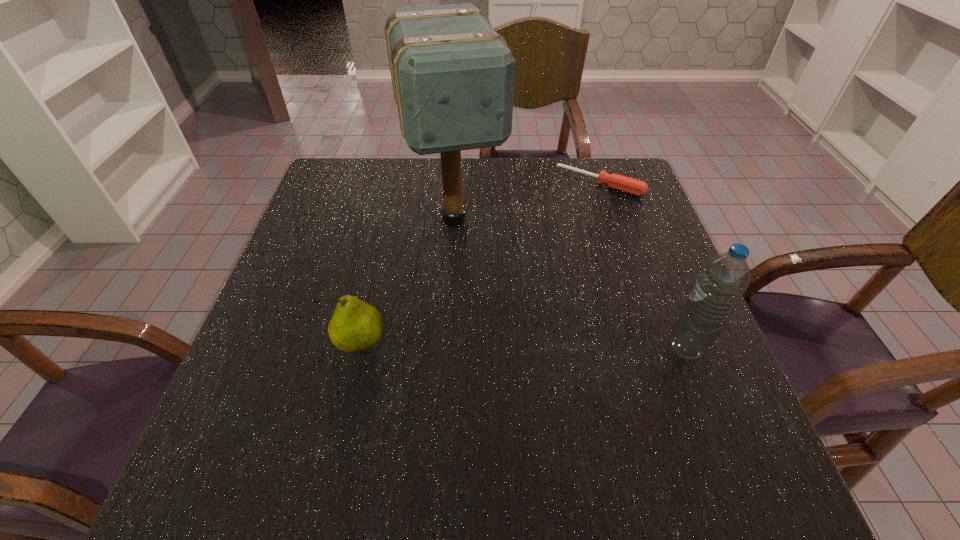
Locate an element on the screen. The image size is (960, 540). vacant space at the right edge is located at coordinates (621, 252).

You are a GUI agent. You are given a task and a screenshot of the screen. Output one action in this format:
    pyautogui.click(x=<x>, y=<y>)
    Task: Click on the free space at the far left corner
    
    Given the screenshot: What is the action you would take?
    pos(375,179)

Where is `vacant space at the near left corner`? The image size is (960, 540). vacant space at the near left corner is located at coordinates (265, 399).

Locate an element on the screen. free point between the screwdriver and the tallest object is located at coordinates (527, 201).

This screenshot has width=960, height=540. I want to click on free point between the mallet and the water bottle, so click(569, 284).

Find the location of a particular element. The width and height of the screenshot is (960, 540). free space between the water bottle and the mallet is located at coordinates (569, 284).

You are a GUI agent. You are given a task and a screenshot of the screen. Output one action in this format:
    pyautogui.click(x=<x>, y=<y>)
    Task: Click on the unoccupied area between the tallest object and the shortest object
    The height and width of the screenshot is (540, 960).
    Given the screenshot: What is the action you would take?
    pyautogui.click(x=527, y=201)

The image size is (960, 540). I want to click on vacant space that is in between the shortest object and the water bottle, so click(x=642, y=266).

The image size is (960, 540). What are the coordinates of `free space between the second tallest object and the mallet` in the screenshot? It's located at (569, 284).

Locate an element on the screen. free space that is in between the water bottle and the mallet is located at coordinates (569, 284).